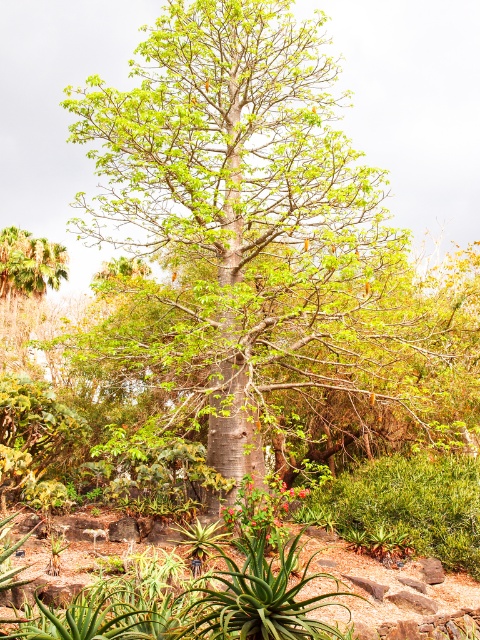
You are standing in the garden and want to pick the bright red petals at center and the bright red flower at center. Which one is closer to you?

The bright red petals at center are closer to you since they are in front of the bright red flower at center.

You are standing in the garden and want to water the smooth bark tree at center. Your watering can holds enough water to reach 25 feet. Can you water the tree without moving closer?

The smooth bark tree at center is 28.30 feet away from the viewer. Since the watering can only reaches 25 feet, you cannot water the tree without moving closer.